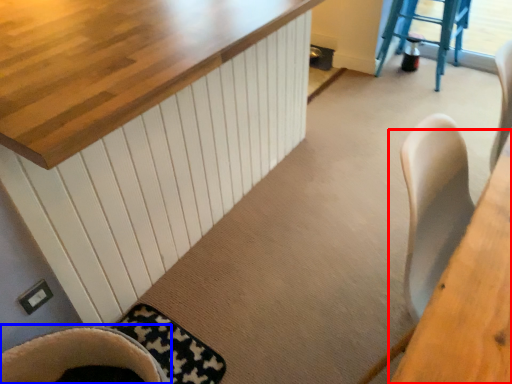
Question: Among these objects, which one is nearest to the camera, table (highlighted by a red box) or chair (highlighted by a blue box)?

Choices:
 (A) table
 (B) chair

Answer: (A)